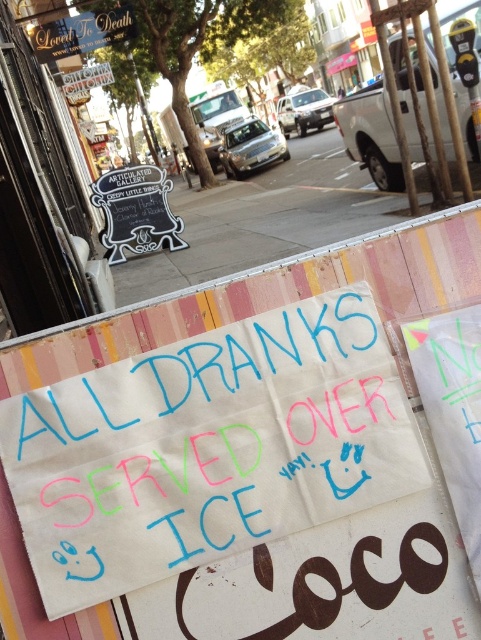
Is white paper sign at center to the right of concrete sidewalk at center from the viewer's perspective?

In fact, white paper sign at center is to the left of concrete sidewalk at center.

Does white paper sign at center have a larger size compared to concrete sidewalk at center?

Incorrect, white paper sign at center is not larger than concrete sidewalk at center.

Does point (92, 506) come closer to viewer compared to point (240, 228)?

Yes, point (92, 506) is in front of point (240, 228).

Where is `white paper sign at center`? white paper sign at center is located at coordinates (236, 477).